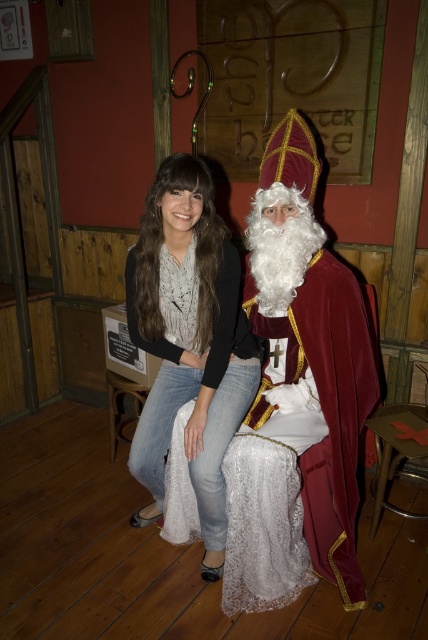
Question: Which of the following is the closest to the observer?

Choices:
 (A) (282, 525)
 (B) (169, 440)

Answer: (A)

Question: Can you confirm if velvet maroon cape at center is positioned above denim jeans at center?

Choices:
 (A) no
 (B) yes

Answer: (B)

Question: Observing the image, what is the correct spatial positioning of velvet maroon cape at center in reference to denim jeans at center?

Choices:
 (A) below
 (B) above

Answer: (B)

Question: Considering the relative positions of velvet maroon cape at center and denim jeans at center in the image provided, where is velvet maroon cape at center located with respect to denim jeans at center?

Choices:
 (A) right
 (B) left

Answer: (A)